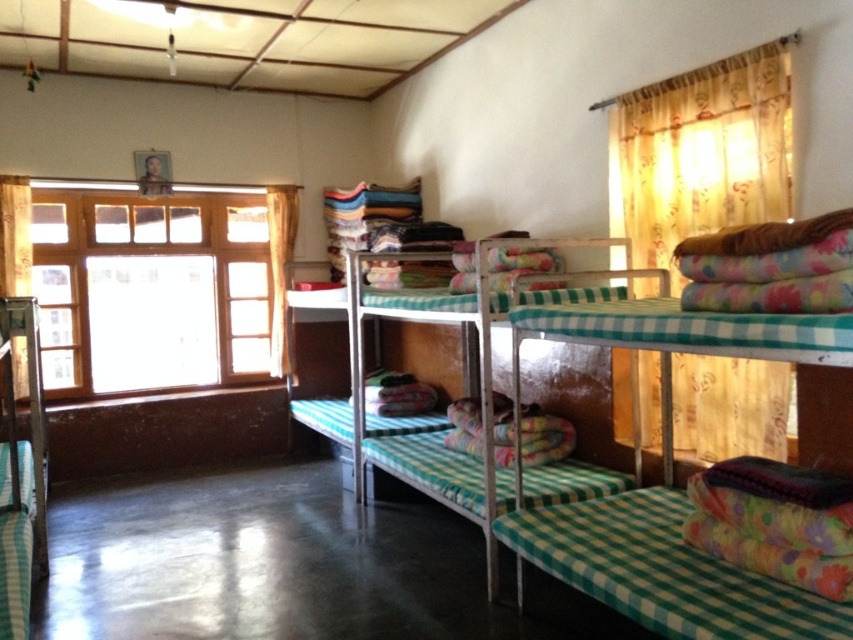
Can you confirm if wooden window at left is wider than green checkered bunk bed at center?

Yes.

Can you confirm if wooden window at left is positioned below green checkered bunk bed at center?

Actually, wooden window at left is above green checkered bunk bed at center.

The height and width of the screenshot is (640, 853). What are the coordinates of `wooden window at left` in the screenshot? It's located at (x=149, y=289).

Is wooden window at left positioned in front of yellow floral fabric at upper right?

No.

Between point (242, 252) and point (691, 72), which one is positioned in front?

Point (691, 72) is more forward.

Locate an element on the screen. wooden window at left is located at coordinates (149, 289).

Measure the distance from green checkered bunk bed at center to yellow fabric curtain at left.

They are 11.38 feet apart.

Between point (714, 332) and point (273, 273), which one is positioned in front?

Point (714, 332)

The image size is (853, 640). I want to click on green checkered bunk bed at center, so click(660, 572).

The image size is (853, 640). I want to click on green checkered bunk bed at center, so click(x=660, y=572).